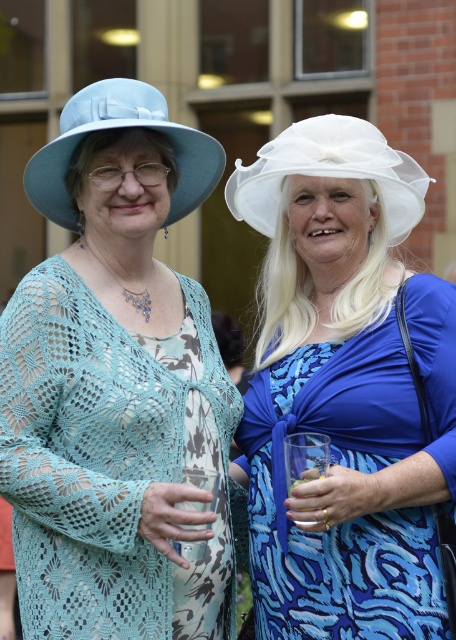
You are a photographer at a social event and want to capture both the matte blue hat at left and the matte blue fabric hat at upper left in the same frame. Which of the two hats is positioned lower in the image?

The matte blue hat at left is positioned lower than the matte blue fabric hat at upper left, so the matte blue hat at left is the one that is lower in the image.

You are a photographer at a garden party and need to position two guests so their hats don not block each other. Given the height difference between the matte blue hat at left and the white sheer hat at upper center, which hat should be placed closer to the camera to ensure the taller one doesn not obscure the shorter one?

The matte blue hat at left is taller than the white sheer hat at upper center. To prevent the taller hat from obscuring the shorter one, the white sheer hat at upper center should be placed closer to the camera.